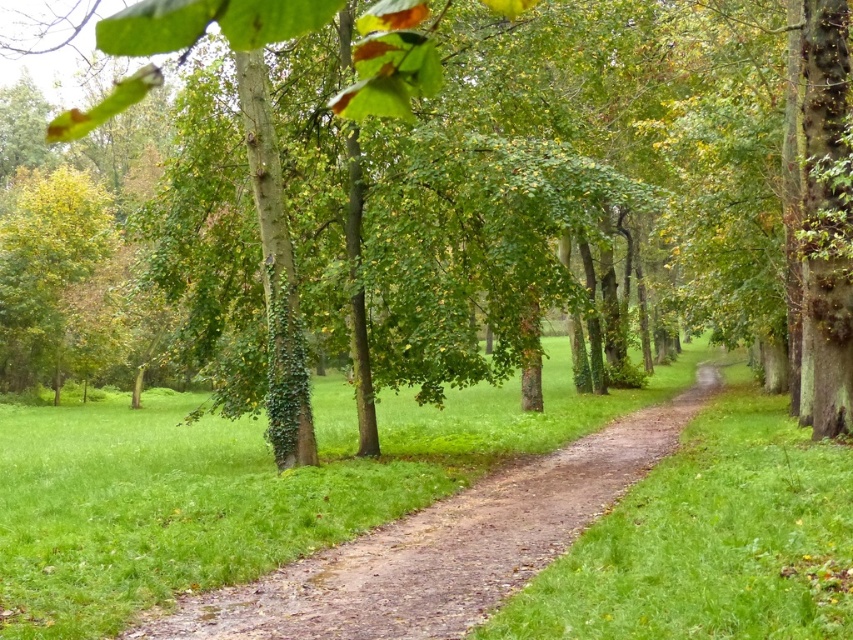
You are a hiker who wants to take a photo of the brown dirt path at center from above. Is the green leafy tree at center blocking your view?

The green leafy tree at center is above the brown dirt path at center, so it would block your view when trying to take a photo from above.

You are standing at the point marked by the coordinates point (827,214) in the park. Looking around, you see a green leafy tree at center. Which direction should you walk to reach the tree?

The point (827,214) is already at the green leafy tree at center, so you are already at the tree.

You are standing in the park and want to take a photo of the green leafy tree at center. If your camera has a maximum focus range of 12 meters, will you be able to capture the tree clearly?

The green leafy tree at center is 12.57 meters away from the viewer, which exceeds the camera maximum focus range of 12 meters. Therefore, the camera cannot focus on the tree clearly.